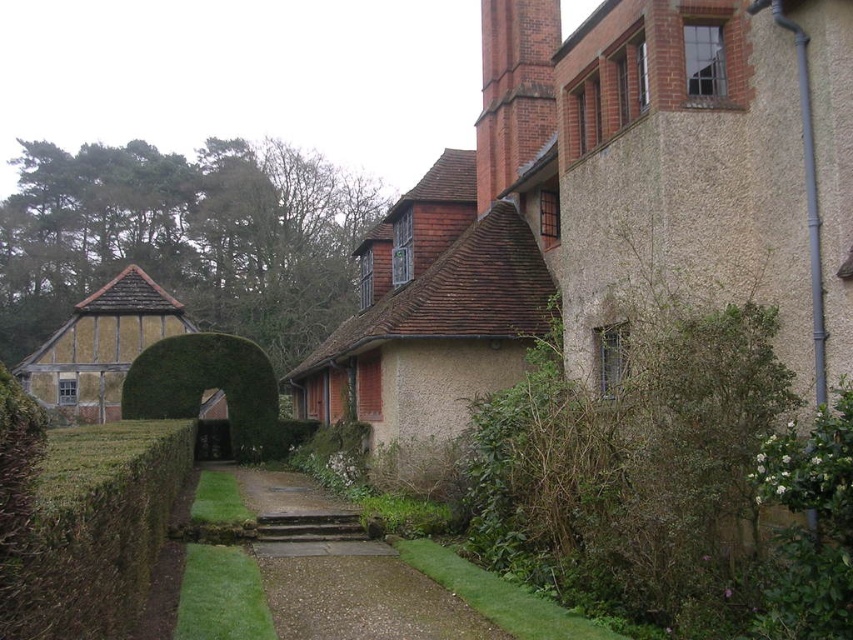
Question: Does green leafy hedge at right have a smaller size compared to gravel pathway at center?

Choices:
 (A) no
 (B) yes

Answer: (B)

Question: Which is farther from the green leafy hedge at lower left?

Choices:
 (A) green leafy hedge at right
 (B) gravel pathway at center
 (C) green leafy hedge at center

Answer: (C)

Question: Which point is closer to the camera?

Choices:
 (A) green leafy hedge at lower left
 (B) green leafy hedge at right
 (C) gravel pathway at center

Answer: (A)

Question: Is gravel pathway at center wider than green leafy hedge at center?

Choices:
 (A) yes
 (B) no

Answer: (A)

Question: Which object appears closest to the camera in this image?

Choices:
 (A) gravel pathway at center
 (B) green leafy hedge at center
 (C) green leafy hedge at right
 (D) green leafy hedge at lower left

Answer: (D)

Question: Does green leafy hedge at lower left have a lesser width compared to green leafy hedge at center?

Choices:
 (A) yes
 (B) no

Answer: (B)